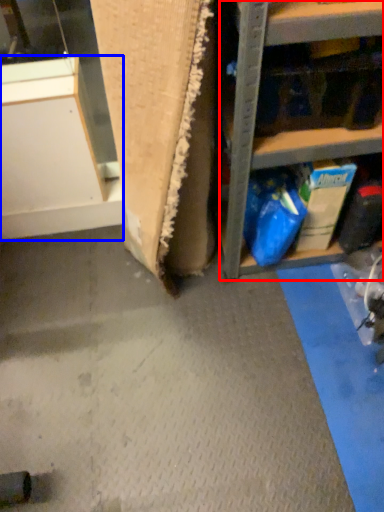
Question: Which point is closer to the camera, shelf (highlighted by a red box) or cabinetry (highlighted by a blue box)?

Choices:
 (A) shelf
 (B) cabinetry

Answer: (A)